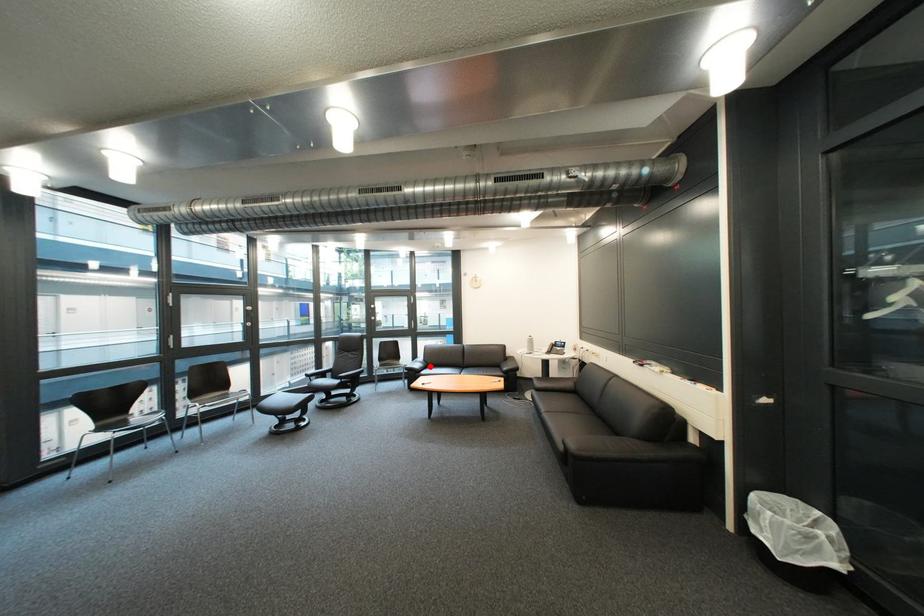
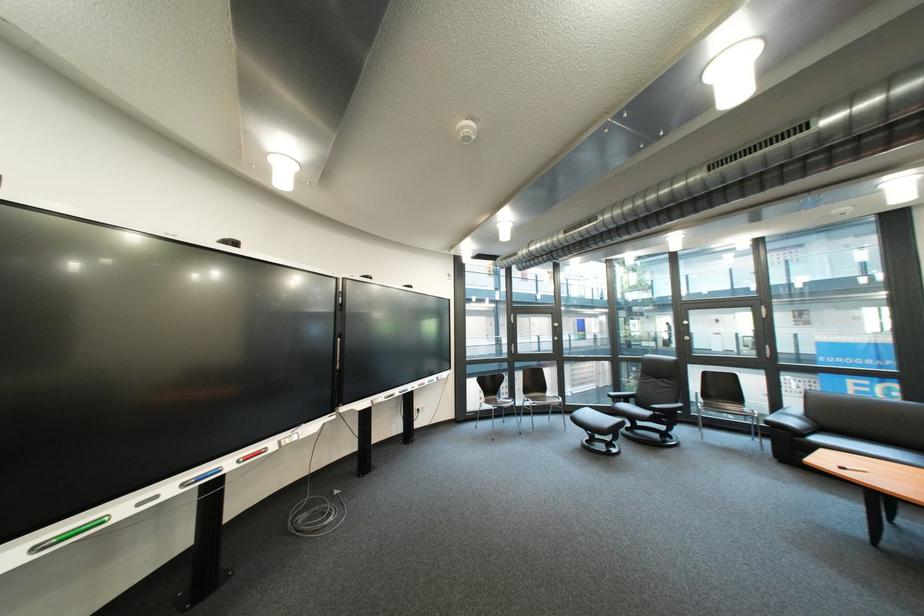
Question: A red point is marked in image1. In image2, is the corresponding 3D point closer to the camera or farther? Reply with the corresponding letter.

Choices:
 (A) The corresponding 3D point is closer.
 (B) The corresponding 3D point is farther.

Answer: (A)